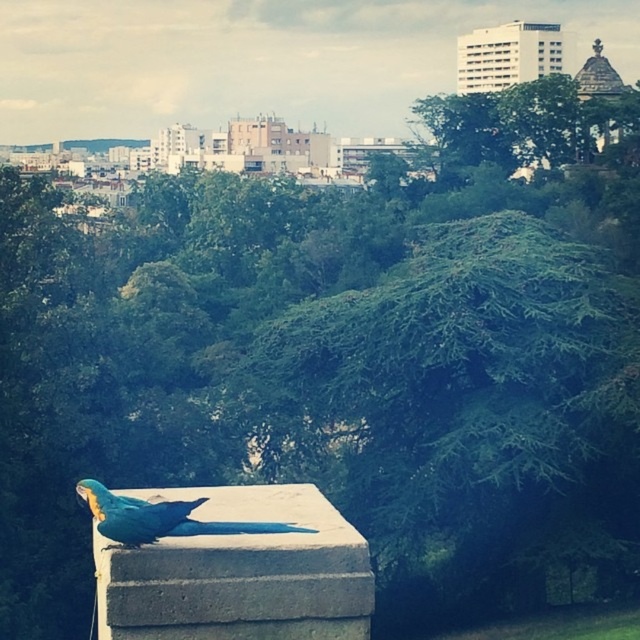
Which is behind, point (332, 580) or point (193, 504)?

Point (193, 504)

Is point (234, 556) more distant than point (177, 518)?

No.

Which is in front, point (128, 589) or point (154, 532)?

Point (128, 589) is in front.

In order to click on blue concrete at center in this screenshot , I will do point(240,572).